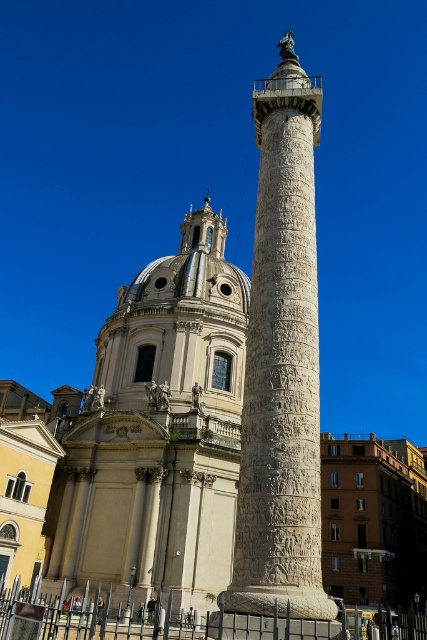
Who is positioned more to the left, white marble dome at center or white stone column at center?

white marble dome at center is more to the left.

Between white marble dome at center and white stone column at center, which one is positioned lower?

white marble dome at center

Is point (218, 372) positioned behind point (295, 292)?

Yes.

Where is `white marble dome at center`? white marble dome at center is located at coordinates (157, 429).